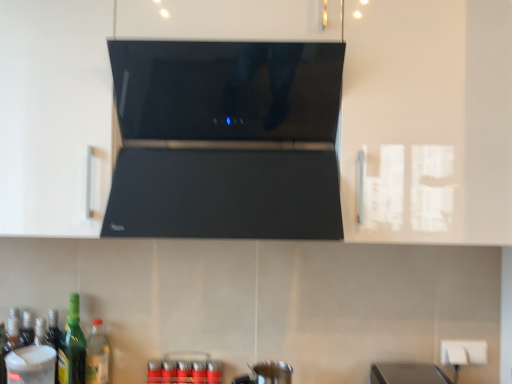
Question: Considering the relative sizes of green glass bottle at lower left, the third bottle from the left, and black glossy range hood at center in the image provided, is green glass bottle at lower left, the third bottle from the left, smaller than black glossy range hood at center?

Choices:
 (A) no
 (B) yes

Answer: (B)

Question: Considering the relative sizes of green glass bottle at lower left, the third bottle from the left, and black glossy range hood at center in the image provided, is green glass bottle at lower left, the third bottle from the left, shorter than black glossy range hood at center?

Choices:
 (A) yes
 (B) no

Answer: (A)

Question: Is green glass bottle at lower left, the third bottle from the left, facing towards black glossy range hood at center?

Choices:
 (A) no
 (B) yes

Answer: (A)

Question: Is green glass bottle at lower left, the 1th bottle viewed from the right, at the left side of black glossy range hood at center?

Choices:
 (A) no
 (B) yes

Answer: (B)

Question: Is green glass bottle at lower left, the 1th bottle viewed from the right, to the right of black glossy range hood at center from the viewer's perspective?

Choices:
 (A) no
 (B) yes

Answer: (A)

Question: From a real-world perspective, is green glass bottle at lower left, the third bottle from the left, above or below green glass bottle at lower left, which ranks as the third bottle in right-to-left order?

Choices:
 (A) above
 (B) below

Answer: (B)

Question: Would you say green glass bottle at lower left, the 1th bottle viewed from the right, is to the left or to the right of green glass bottle at lower left, which ranks as the third bottle in right-to-left order, in the picture?

Choices:
 (A) right
 (B) left

Answer: (A)

Question: From the image's perspective, is green glass bottle at lower left, the 1th bottle viewed from the right, above or below green glass bottle at lower left, which ranks as the third bottle in right-to-left order?

Choices:
 (A) above
 (B) below

Answer: (B)

Question: Looking at their shapes, would you say green glass bottle at lower left, the 1th bottle viewed from the right, is wider or thinner than green glass bottle at lower left, the first bottle in the left-to-right sequence?

Choices:
 (A) thin
 (B) wide

Answer: (B)

Question: From the image's perspective, is metallic silver can at lower center above or below green glass bottle at lower left, which appears as the second bottle when viewed from the right?

Choices:
 (A) below
 (B) above

Answer: (A)

Question: Considering their positions, is metallic silver can at lower center located in front of or behind green glass bottle at lower left, which appears as the second bottle when viewed from the right?

Choices:
 (A) front
 (B) behind

Answer: (A)

Question: In terms of width, does metallic silver can at lower center look wider or thinner when compared to green glass bottle at lower left, which appears as the second bottle when viewed from the right?

Choices:
 (A) thin
 (B) wide

Answer: (A)

Question: From a real-world perspective, is metallic silver can at lower center physically located above or below green glass bottle at lower left, which appears as the second bottle when viewed from the right?

Choices:
 (A) above
 (B) below

Answer: (B)

Question: From the image's perspective, is black glossy range hood at center located above or below green glass bottle at lower left, the third bottle from the left?

Choices:
 (A) above
 (B) below

Answer: (A)

Question: From a real-world perspective, is black glossy range hood at center physically located above or below green glass bottle at lower left, the 1th bottle viewed from the right?

Choices:
 (A) below
 (B) above

Answer: (B)